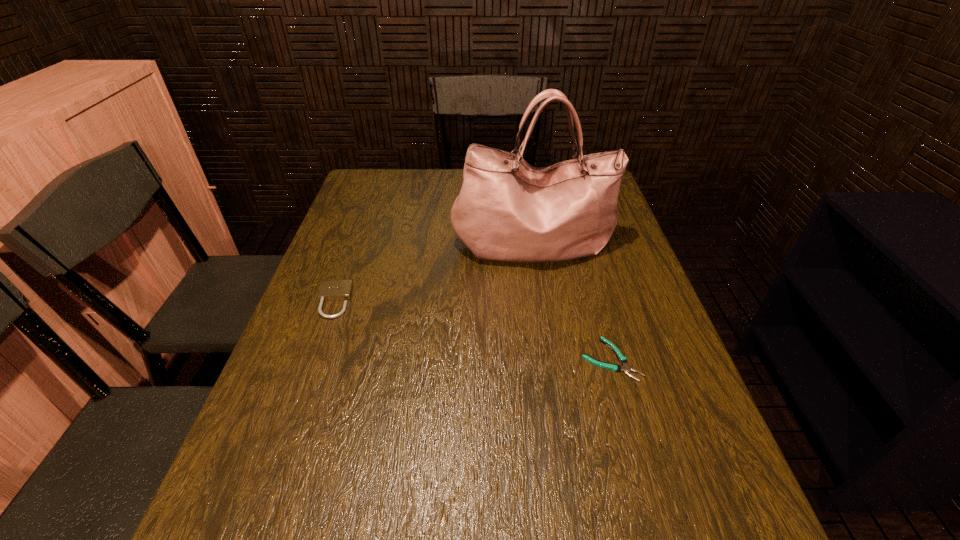
Find the location of a particular element. the tallest object is located at coordinates (508, 210).

Locate an element on the screen. handbag is located at coordinates (508, 210).

Find the location of a particular element. The height and width of the screenshot is (540, 960). the second tallest object is located at coordinates (333, 290).

Image resolution: width=960 pixels, height=540 pixels. I want to click on the leftmost object, so click(x=333, y=290).

Identify the location of the nearest object. Image resolution: width=960 pixels, height=540 pixels. click(x=626, y=368).

Where is `pliers`? The image size is (960, 540). pliers is located at coordinates (626, 368).

Where is `free space located at the front of the tallest object with handles`? Image resolution: width=960 pixels, height=540 pixels. free space located at the front of the tallest object with handles is located at coordinates (552, 360).

I want to click on vacant space situated on the back of the second nearest object, so click(363, 219).

Locate an element on the screen. vacant region located 0.250m on the left of the pliers is located at coordinates (466, 359).

At what (x,y) coordinates should I click in order to perform the action: click on object located in the left edge section of the desktop. Please return your answer as a coordinate pair (x, y). This screenshot has width=960, height=540. Looking at the image, I should click on 333,290.